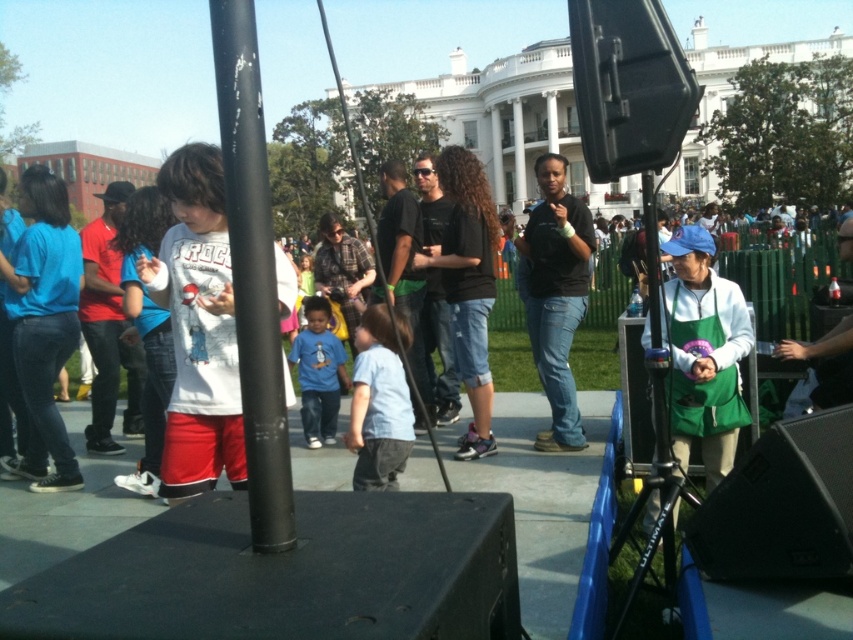
Question: Which point is farther to the camera?

Choices:
 (A) matte red shirt at center
 (B) light blue fabric shirt at center

Answer: (A)

Question: Is white matte shirt at center bigger than matte black shirt at center?

Choices:
 (A) no
 (B) yes

Answer: (A)

Question: Does white matte shirt at center appear on the right side of plaid shirt at center?

Choices:
 (A) no
 (B) yes

Answer: (B)

Question: Does matte black shirt at center have a greater width compared to plaid shirt at center?

Choices:
 (A) yes
 (B) no

Answer: (B)

Question: Which point is closer to the camera taking this photo?

Choices:
 (A) (416, 180)
 (B) (119, 214)
 (C) (209, 358)

Answer: (C)

Question: Which point is farther to the camera?

Choices:
 (A) (117, 316)
 (B) (212, 481)
 (C) (300, 390)
 (D) (386, 220)

Answer: (D)